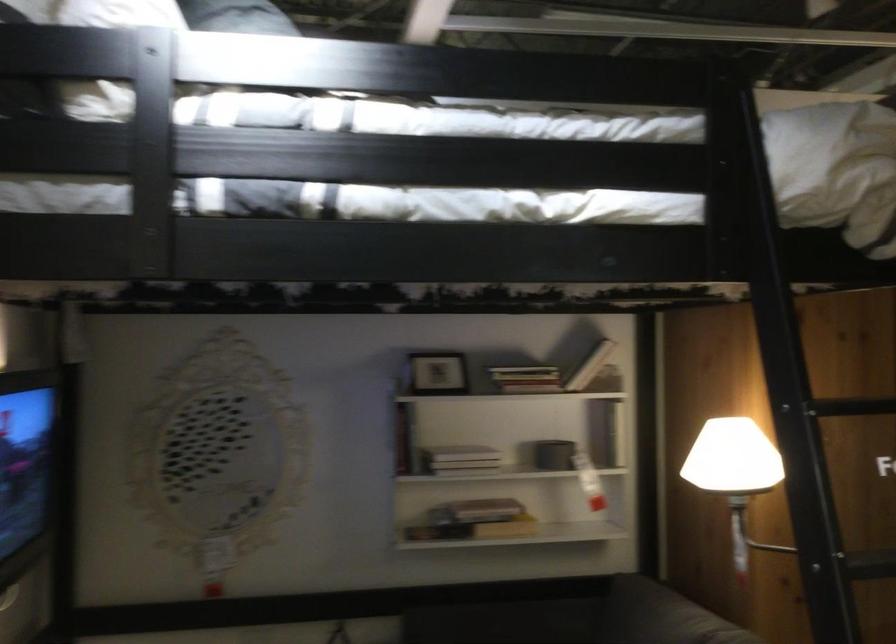
Find where to lift the small picture frame. Please return your answer as a coordinate pair (x, y).

(437, 373)